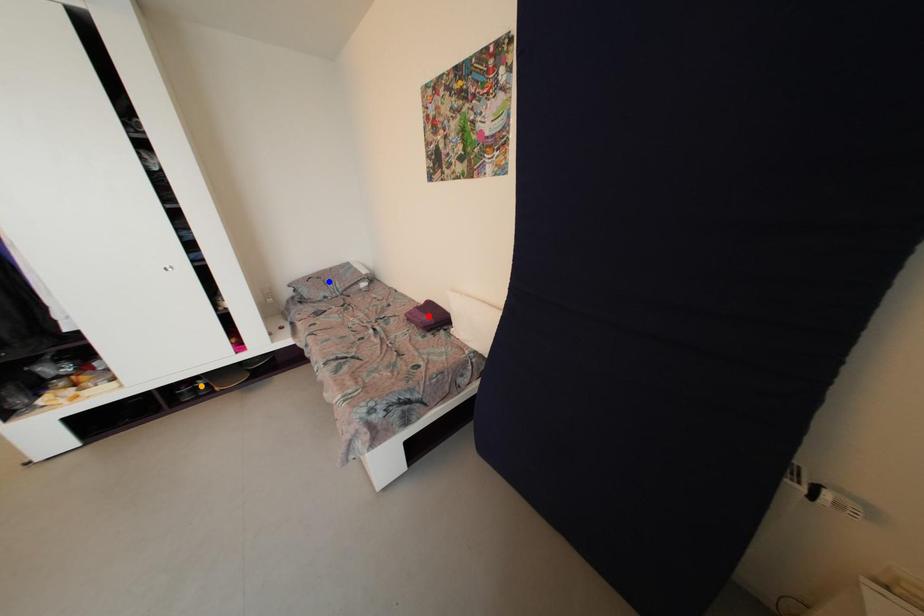
Order these from nearest to farthest:
red point
blue point
orange point

1. red point
2. orange point
3. blue point